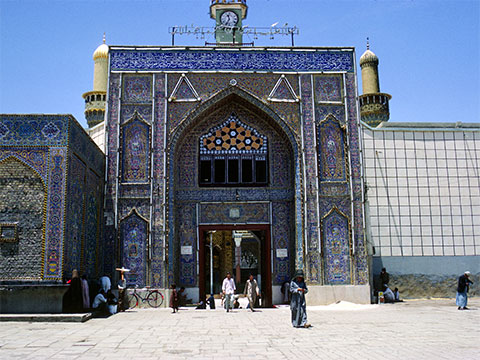
Image resolution: width=480 pixels, height=360 pixels. In order to click on minute hand on clock in this screenshot , I will do `click(226, 21)`.